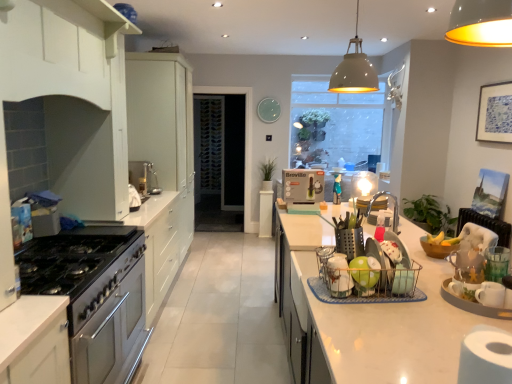
Question: Considering the relative sizes of white glossy countertop at right and green matte plant at center, arranged as the second plant when viewed from the right, in the image provided, is white glossy countertop at right shorter than green matte plant at center, arranged as the second plant when viewed from the right,?

Choices:
 (A) no
 (B) yes

Answer: (A)

Question: Does white glossy countertop at right have a lesser width compared to green matte plant at center, arranged as the second plant when viewed from the right?

Choices:
 (A) no
 (B) yes

Answer: (A)

Question: Considering the relative sizes of white glossy countertop at right and green matte plant at center, arranged as the second plant when viewed from the right, in the image provided, is white glossy countertop at right smaller than green matte plant at center, arranged as the second plant when viewed from the right,?

Choices:
 (A) yes
 (B) no

Answer: (B)

Question: Is white glossy countertop at right taller than green matte plant at center, which is the 1th plant from top to bottom?

Choices:
 (A) no
 (B) yes

Answer: (B)

Question: Is white glossy countertop at right wider than green matte plant at center, arranged as the second plant when viewed from the right?

Choices:
 (A) no
 (B) yes

Answer: (B)

Question: Would you say white glossy countertop at right is to the left or to the right of matte white light bulb at center, marked as the 1th appliance in a right-to-left arrangement, in the picture?

Choices:
 (A) right
 (B) left

Answer: (A)

Question: Considering the positions of white glossy countertop at right and matte white light bulb at center, the fourth appliance when ordered from front to back, in the image, is white glossy countertop at right bigger or smaller than matte white light bulb at center, the fourth appliance when ordered from front to back,?

Choices:
 (A) big
 (B) small

Answer: (A)

Question: In terms of width, does white glossy countertop at right look wider or thinner when compared to matte white light bulb at center, the fourth appliance viewed from the left?

Choices:
 (A) wide
 (B) thin

Answer: (A)

Question: From a real-world perspective, is white glossy countertop at right physically located above or below matte white light bulb at center, which is counted as the first appliance, starting from the back?

Choices:
 (A) above
 (B) below

Answer: (B)

Question: Is point (384, 160) closer or farther from the camera than point (489, 96)?

Choices:
 (A) farther
 (B) closer

Answer: (A)

Question: From the image's perspective, is translucent glass window at center located above or below blue paper picture frame at upper right?

Choices:
 (A) above
 (B) below

Answer: (A)

Question: In terms of width, does translucent glass window at center look wider or thinner when compared to blue paper picture frame at upper right?

Choices:
 (A) thin
 (B) wide

Answer: (B)

Question: Considering their positions, is translucent glass window at center located in front of or behind blue paper picture frame at upper right?

Choices:
 (A) front
 (B) behind

Answer: (B)

Question: In terms of size, does green matte dish rack at center, the fourth appliance when ordered from right to left, appear bigger or smaller than green matte plant at center, which appears as the 1th plant when viewed from the back?

Choices:
 (A) big
 (B) small

Answer: (B)

Question: In the image, is green matte dish rack at center, arranged as the first appliance when viewed from the front, on the left side or the right side of green matte plant at center, arranged as the 2th plant when ordered from the bottom?

Choices:
 (A) right
 (B) left

Answer: (A)